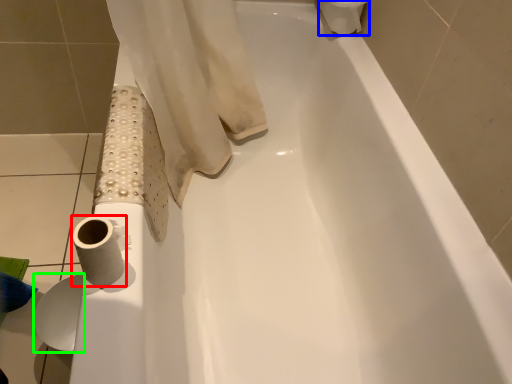
Question: Which is farther away from toilet paper (highlighted by a red box)? toilet paper (highlighted by a blue box) or toilet paper (highlighted by a green box)?

Choices:
 (A) toilet paper
 (B) toilet paper

Answer: (A)